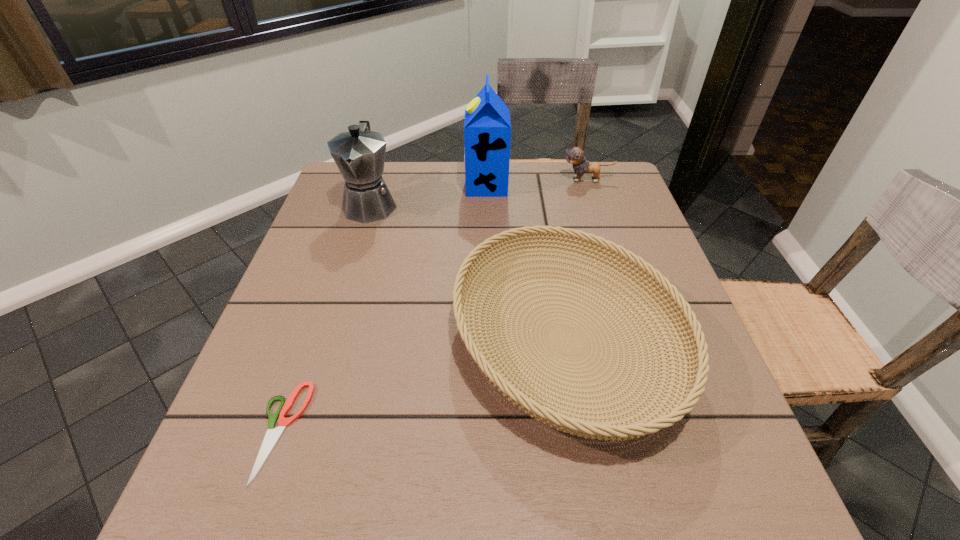
This screenshot has width=960, height=540. What are the coordinates of `free point located 0.280m on the front-facing side of the kitten` in the screenshot? It's located at (463, 180).

Find the location of a particular element. vacant space located on the front-facing side of the kitten is located at coordinates (526, 180).

The height and width of the screenshot is (540, 960). In order to click on vacant space located on the left of the basket in this screenshot , I will do `click(318, 341)`.

Locate an element on the screen. This screenshot has width=960, height=540. vacant area located on the right of the scissors is located at coordinates (538, 431).

Where is `carton that is positioned at the far edge`? carton that is positioned at the far edge is located at coordinates (487, 128).

This screenshot has height=540, width=960. In order to click on coffeepot present at the far edge in this screenshot , I will do `click(359, 154)`.

Identify the location of kitten that is at the far edge. (575, 156).

Where is `object located in the near edge section of the desktop`? object located in the near edge section of the desktop is located at coordinates (272, 435).

Identify the location of coffeepot at the left edge. (359, 154).

Identify the location of scissors present at the left edge. (272, 435).